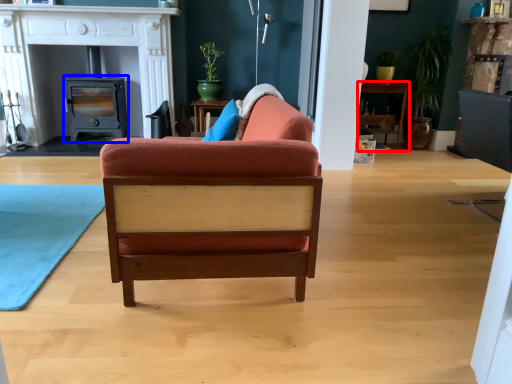
Question: Which point is closer to the camera, table (highlighted by a red box) or appliance (highlighted by a blue box)?

Choices:
 (A) table
 (B) appliance

Answer: (B)